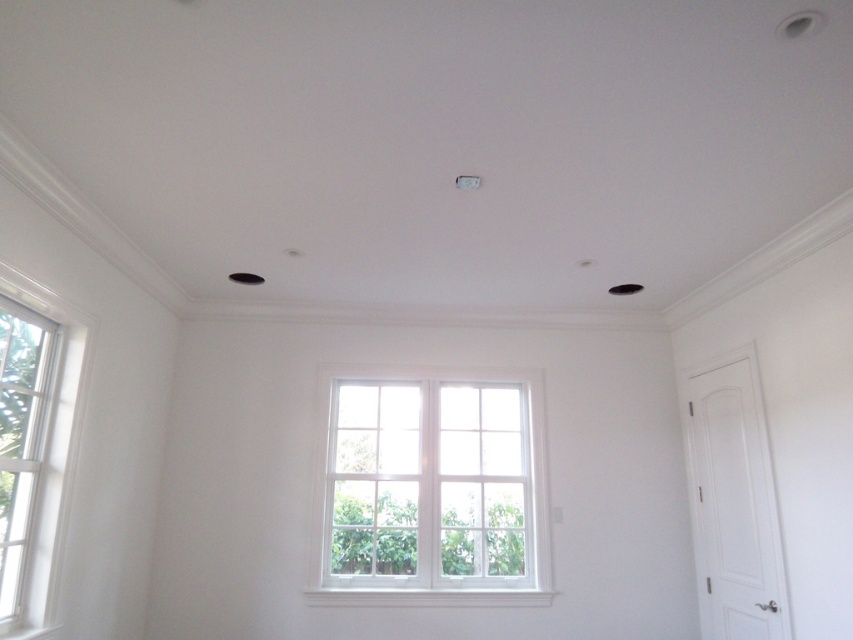
Can you confirm if white painted wood bay window at center is shorter than white wood window at left?

Yes.

Which is below, white painted wood bay window at center or white wood window at left?

white painted wood bay window at center

Identify the location of white painted wood bay window at center. The width and height of the screenshot is (853, 640). (430, 488).